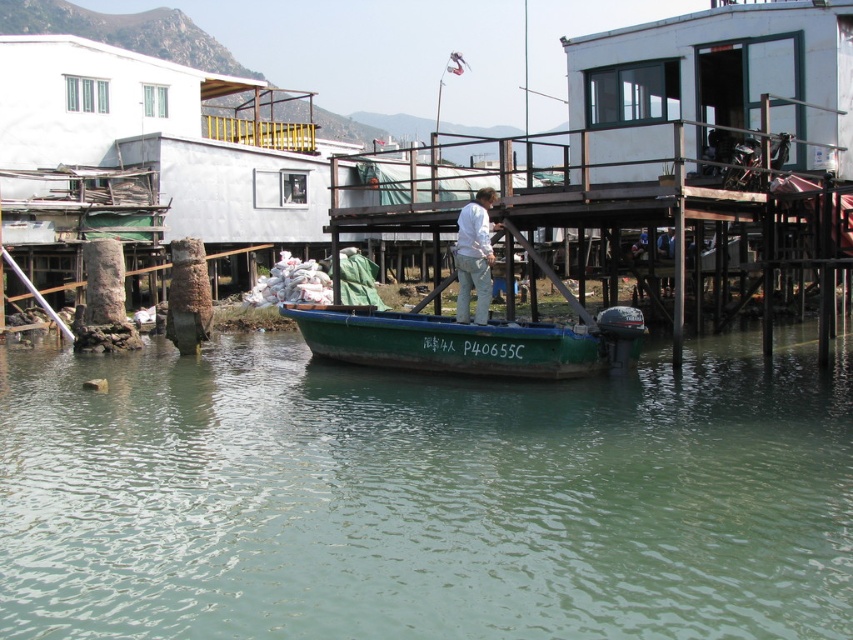
Between point (331, 328) and point (476, 248), which one is positioned behind?

The point (331, 328) is behind.

What are the coordinates of `green matte boat at center` in the screenshot? It's located at (473, 339).

Measure the distance between point (433, 362) and camera.

Point (433, 362) is 19.41 meters away from camera.

At what (x,y) coordinates should I click in order to perform the action: click on green matte boat at center. Please return your answer as a coordinate pair (x, y). The width and height of the screenshot is (853, 640). Looking at the image, I should click on (473, 339).

Which is in front, point (824, 461) or point (563, 291)?

Positioned in front is point (824, 461).

Can you confirm if green matte water at center is positioned to the right of green matte boat at center?

In fact, green matte water at center is to the left of green matte boat at center.

Which is behind, point (257, 488) or point (506, 333)?

The point (506, 333) is more distant.

In order to click on green matte water at center in this screenshot , I will do `click(424, 497)`.

Consider the image. Can you confirm if green matte water at center is bigger than white matte shirt at center?

Yes.

Can you confirm if green matte water at center is wider than white matte shirt at center?

Indeed, green matte water at center has a greater width compared to white matte shirt at center.

Image resolution: width=853 pixels, height=640 pixels. In order to click on green matte water at center in this screenshot , I will do `click(424, 497)`.

Find the location of a particular element. The image size is (853, 640). green matte water at center is located at coordinates (424, 497).